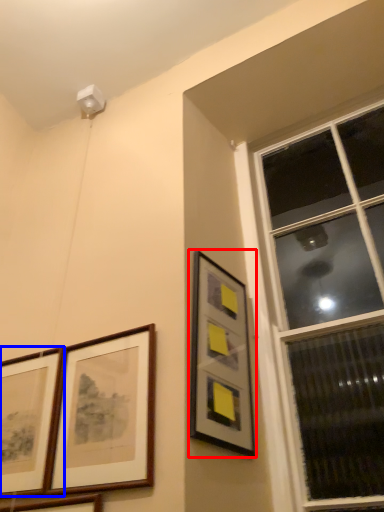
Question: Which of the following is the farthest to the observer, picture frame (highlighted by a red box) or picture frame (highlighted by a blue box)?

Choices:
 (A) picture frame
 (B) picture frame

Answer: (B)